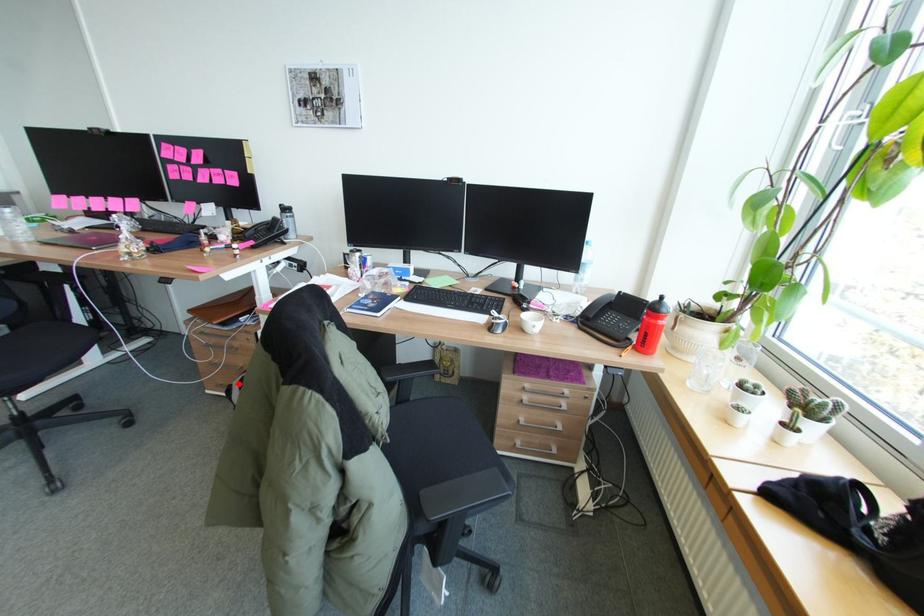
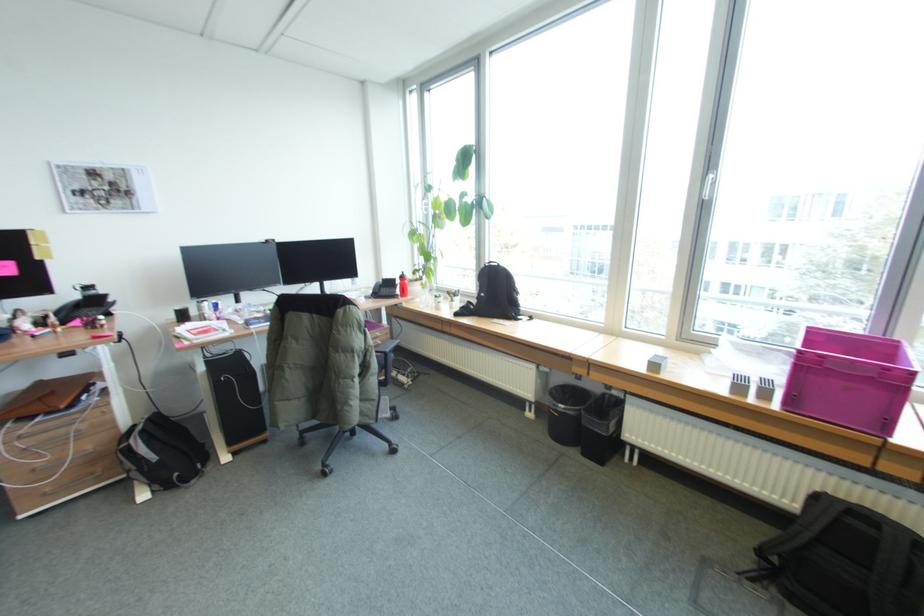
Question: I am providing you with two images of the same scene from different viewpoints. Image1 has a red point marked. In image2, the corresponding 3D location appears at what relative position? Reply with the corresponding letter.

Choices:
 (A) Closer
 (B) Farther

Answer: (A)